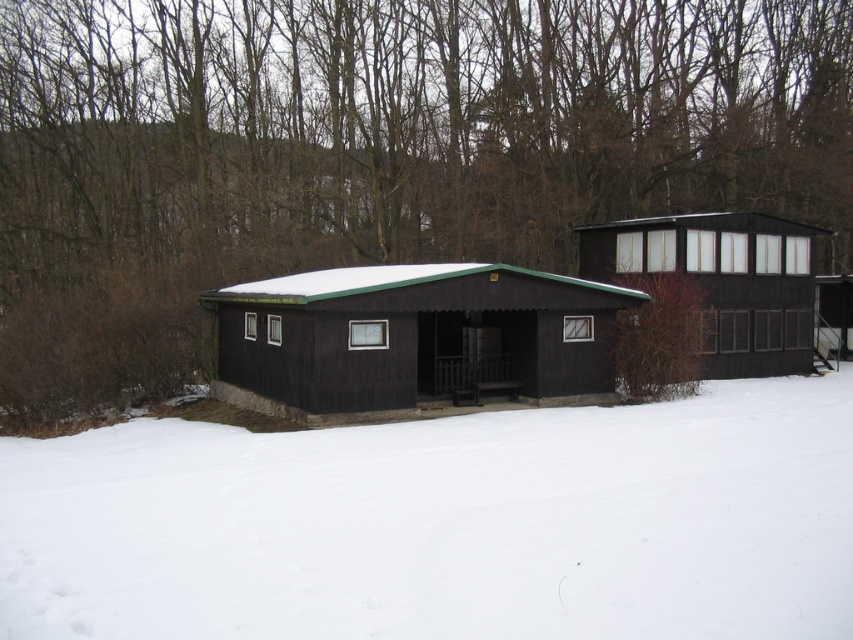
Question: Which object is farther from the camera taking this photo?

Choices:
 (A) matte black cabin at center
 (B) brown wood tree at upper center

Answer: (B)

Question: Does brown wood tree at upper center have a greater width compared to matte black cabin at upper right?

Choices:
 (A) no
 (B) yes

Answer: (B)

Question: Which object appears closest to the camera in this image?

Choices:
 (A) brown wood tree at upper center
 (B) matte black cabin at center

Answer: (B)

Question: Which point is closer to the camera taking this photo?

Choices:
 (A) (708, 282)
 (B) (247, 362)
 (C) (225, 211)

Answer: (B)

Question: Is matte black cabin at center bigger than matte black cabin at upper right?

Choices:
 (A) yes
 (B) no

Answer: (B)

Question: Is brown wood tree at upper center behind matte black cabin at center?

Choices:
 (A) yes
 (B) no

Answer: (A)